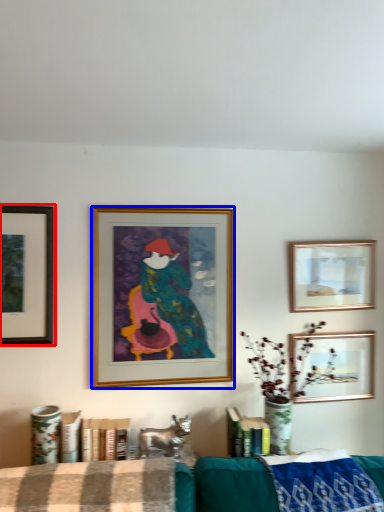
Question: Which point is closer to the camera, picture frame (highlighted by a red box) or picture frame (highlighted by a blue box)?

Choices:
 (A) picture frame
 (B) picture frame

Answer: (A)